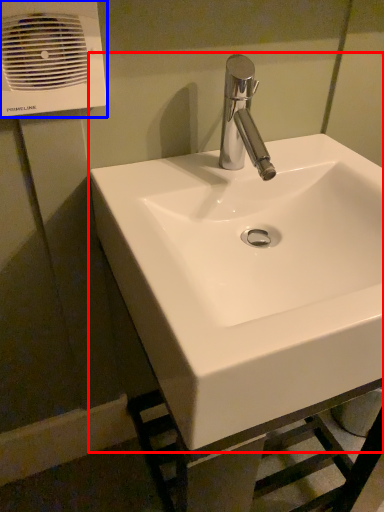
Question: Which of the following is the farthest to the observer, sink (highlighted by a red box) or air conditioning (highlighted by a blue box)?

Choices:
 (A) sink
 (B) air conditioning

Answer: (B)